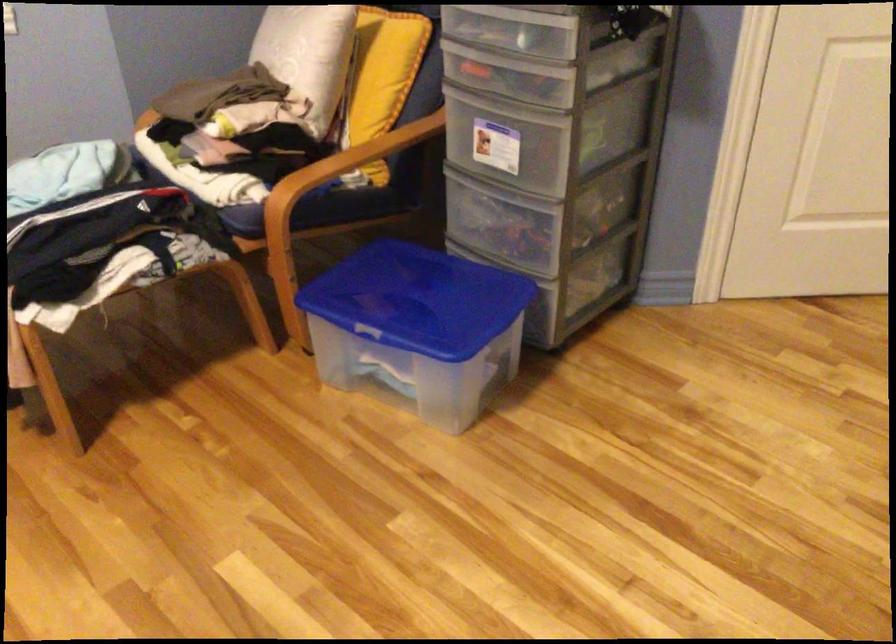
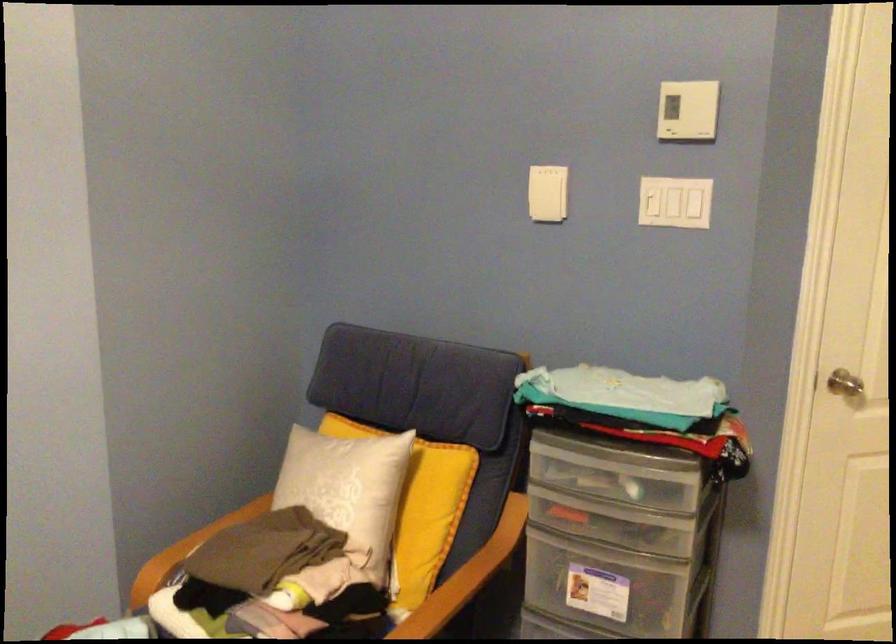
Where in the second image is the point corresponding to pixel 371 78 from the first image?

(419, 507)